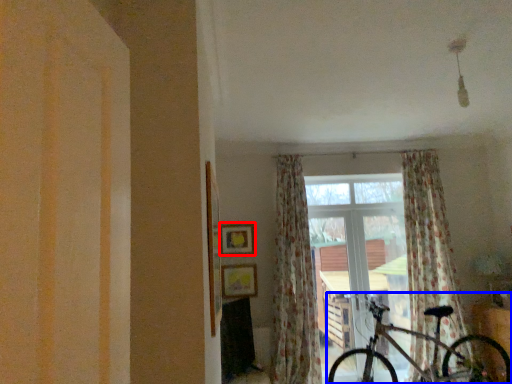
Question: Which of the following is the farthest to the observer, picture frame (highlighted by a red box) or bicycle (highlighted by a blue box)?

Choices:
 (A) picture frame
 (B) bicycle

Answer: (A)